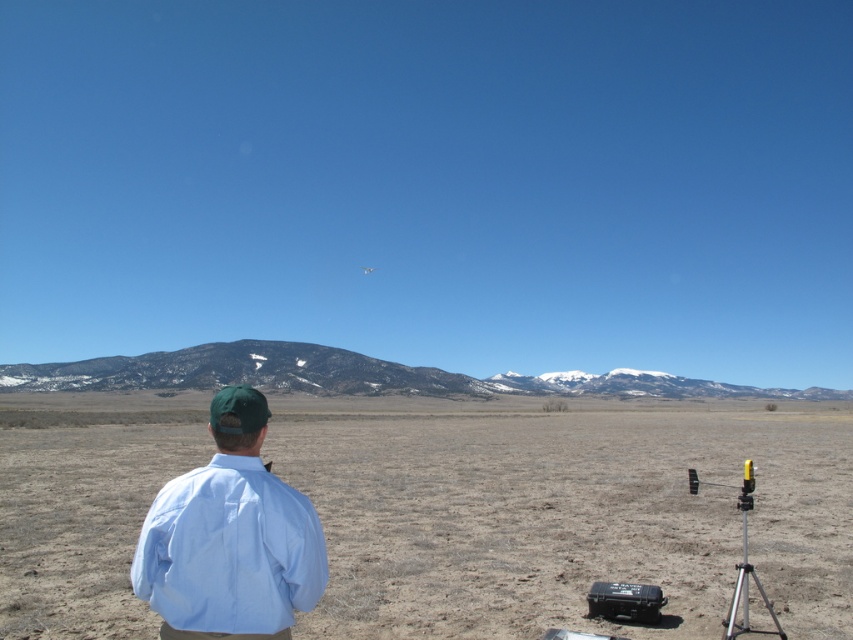
Based on the scene description, what is located at the coordinates point (566, 512)?

The coordinates point (566, 512) indicate brown dry grass at center.

You are a photographer standing at the location of the light blue cotton shirt at center. You want to capture a photo of the silver metallic tripod at lower right without moving. Can you do this using a telephoto lens with a minimum focusing distance of 5 meters?

The light blue cotton shirt at center is 8.51 meters from the silver metallic tripod at lower right. Since the minimum focusing distance is 5 meters, the photographer can capture the photo without moving because the distance is within the lens capability.